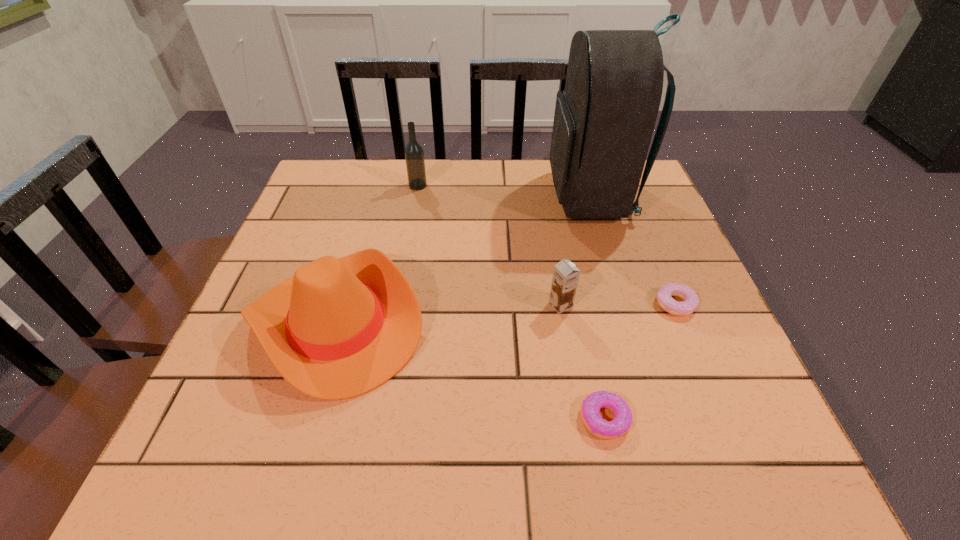
Find the location of `vacant space that satisfies the following two spatial constraints: 1. on the front-facing side of the tallest object; 2. on the right side of the farther doughnut`. vacant space that satisfies the following two spatial constraints: 1. on the front-facing side of the tallest object; 2. on the right side of the farther doughnut is located at coordinates (623, 304).